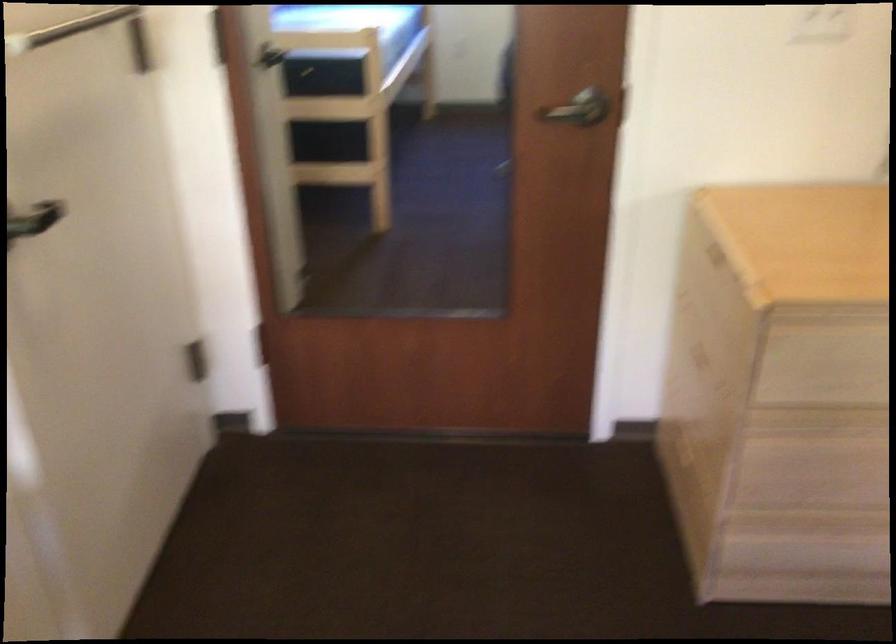
Where is `black wall handle`? black wall handle is located at coordinates (35, 219).